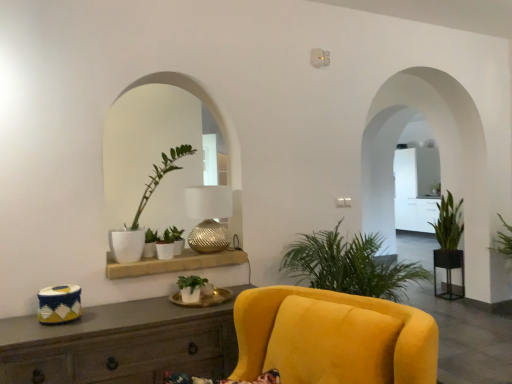
Question: Does green leafy plant at right, positioned as the 1th houseplant in right-to-left order, lie in front of matte white pot at center, the 5th houseplant from the right?

Choices:
 (A) no
 (B) yes

Answer: (A)

Question: Considering the relative sizes of green leafy plant at right, acting as the fifth houseplant starting from the front, and matte white pot at center, the 2th houseplant viewed from the left, in the image provided, is green leafy plant at right, acting as the fifth houseplant starting from the front, shorter than matte white pot at center, the 2th houseplant viewed from the left,?

Choices:
 (A) no
 (B) yes

Answer: (B)

Question: Is green leafy plant at right, acting as the fifth houseplant starting from the front, facing away from matte white pot at center, which is the 5th houseplant from back to front?

Choices:
 (A) no
 (B) yes

Answer: (A)

Question: Is green leafy plant at right, the sixth houseplant viewed from the left, surrounding matte white pot at center, the 5th houseplant from the right?

Choices:
 (A) no
 (B) yes

Answer: (A)

Question: Is the surface of green leafy plant at right, positioned as the 1th houseplant in right-to-left order, in direct contact with matte white pot at center, the 2th houseplant viewed from the left?

Choices:
 (A) yes
 (B) no

Answer: (B)

Question: From the image's perspective, does green leafy plant at right, acting as the fifth houseplant starting from the front, appear lower than matte white pot at center, which is the 5th houseplant from back to front?

Choices:
 (A) yes
 (B) no

Answer: (A)

Question: Considering the relative sizes of metallic textured lamp at center and metallic round table at right, which is counted as the 2th round table, starting from the left, in the image provided, is metallic textured lamp at center shorter than metallic round table at right, which is counted as the 2th round table, starting from the left,?

Choices:
 (A) yes
 (B) no

Answer: (A)

Question: From the image's perspective, is metallic textured lamp at center over metallic round table at right, which is the first round table in back-to-front order?

Choices:
 (A) yes
 (B) no

Answer: (A)

Question: Considering the relative sizes of metallic textured lamp at center and metallic round table at right, which is the first round table in back-to-front order, in the image provided, is metallic textured lamp at center wider than metallic round table at right, which is the first round table in back-to-front order,?

Choices:
 (A) no
 (B) yes

Answer: (B)

Question: Is metallic textured lamp at center positioned behind metallic round table at right, which ranks as the 1th round table in bottom-to-top order?

Choices:
 (A) no
 (B) yes

Answer: (A)

Question: Considering the relative sizes of metallic textured lamp at center and metallic round table at right, which is counted as the 2th round table, starting from the left, in the image provided, is metallic textured lamp at center taller than metallic round table at right, which is counted as the 2th round table, starting from the left,?

Choices:
 (A) no
 (B) yes

Answer: (A)

Question: From a real-world perspective, is metallic textured lamp at center positioned over metallic round table at right, the 2th round table in the front-to-back sequence, based on gravity?

Choices:
 (A) no
 (B) yes

Answer: (B)

Question: Can you confirm if green leafy plant at right, acting as the fifth houseplant starting from the front, is smaller than white ceramic round table at center, the 1th round table when ordered from front to back?

Choices:
 (A) yes
 (B) no

Answer: (B)